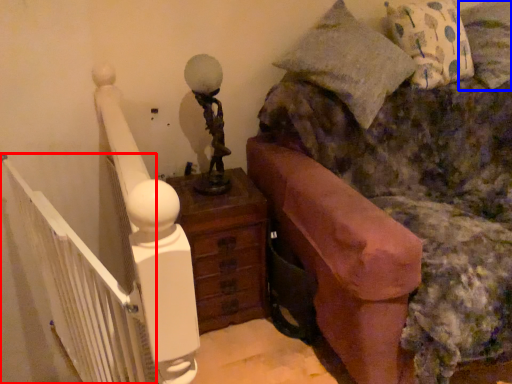
Question: Which of the following is the closest to the observer, balustrade (highlighted by a red box) or pillow (highlighted by a blue box)?

Choices:
 (A) balustrade
 (B) pillow

Answer: (A)